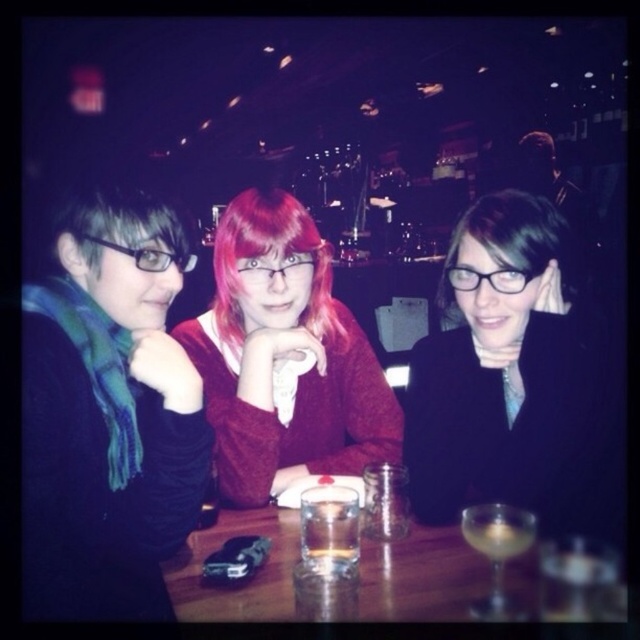
You are a photographer trying to capture a closeup shot of the matte red sweater at center without the pink silky hair at center appearing in the frame. Is this possible given their positions?

The matte red sweater at center is in front of the pink silky hair at center, so it would block the view of the hair. Therefore, you can take a closeup shot of the matte red sweater at center without the pink silky hair at center appearing in the frame.